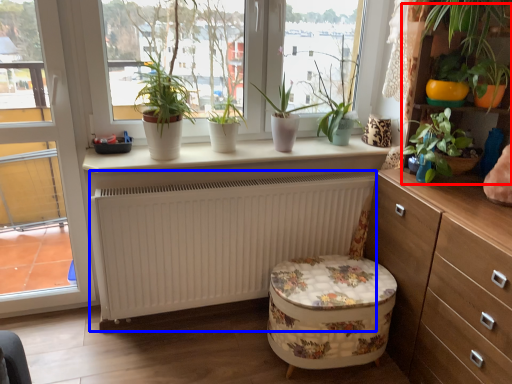
Question: Among these objects, which one is nearest to the camera, bookshelf (highlighted by a red box) or radiator (highlighted by a blue box)?

Choices:
 (A) bookshelf
 (B) radiator

Answer: (A)